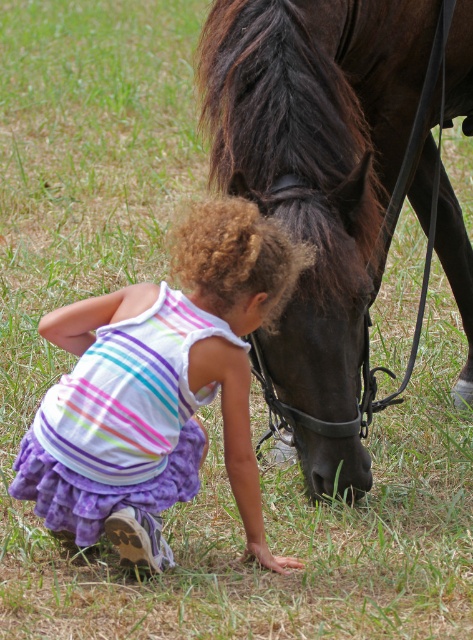
You are a photographer trying to capture a closeup of the child and the horse. You notice two points in the scene marked as point 1 at coordinates point (365, 24) and point 2 at coordinates point (52, 323). Which point is closer to your camera lens?

Point (365, 24) is further to the camera than point (52, 323), so the point closer to the camera lens is point (52, 323).